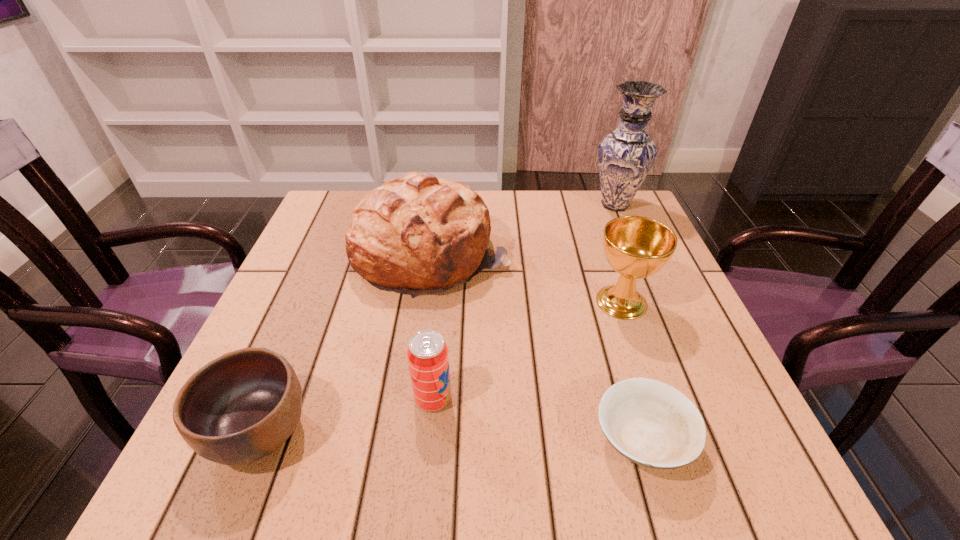
Image resolution: width=960 pixels, height=540 pixels. In the image, there is a desktop. Identify the location of free space at the near left corner. (240, 483).

Find the location of `free space at the far right corner of the desktop`. free space at the far right corner of the desktop is located at coordinates (595, 212).

The width and height of the screenshot is (960, 540). I want to click on free space between the chalice and the third shortest object, so click(x=527, y=350).

Locate an element on the screen. vacant area that lies between the shortest object and the soda can is located at coordinates (537, 419).

Where is `vacant space that is in between the shorter bowl and the fifth tallest object`? vacant space that is in between the shorter bowl and the fifth tallest object is located at coordinates (450, 435).

Where is `vacant region between the chalice and the fourth tallest object`? The width and height of the screenshot is (960, 540). vacant region between the chalice and the fourth tallest object is located at coordinates (527, 350).

This screenshot has width=960, height=540. I want to click on free space between the bread and the chalice, so click(527, 278).

Identify the location of vacant space in between the vase and the fifth tallest object. The height and width of the screenshot is (540, 960). (438, 318).

Image resolution: width=960 pixels, height=540 pixels. I want to click on free space between the shortest object and the chalice, so click(632, 370).

You are a GUI agent. You are given a task and a screenshot of the screen. Output one action in this format:
    pyautogui.click(x=<x>, y=<y>)
    Task: Click on the unoccupied area between the chalice and the bread
    This screenshot has height=540, width=960.
    Given the screenshot: What is the action you would take?
    pyautogui.click(x=527, y=278)